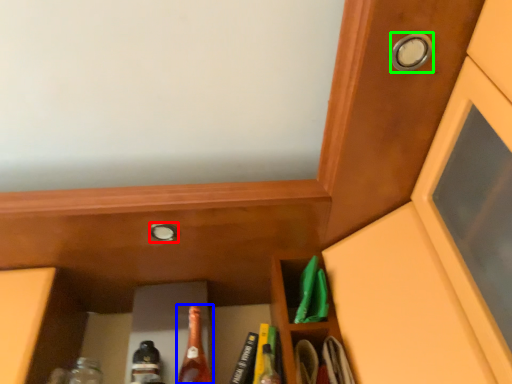
Question: Which object is the closest to the knob (highlighted by a red box)? Choose among these: beer bottle (highlighted by a blue box) or knob (highlighted by a green box).

Choices:
 (A) beer bottle
 (B) knob

Answer: (A)